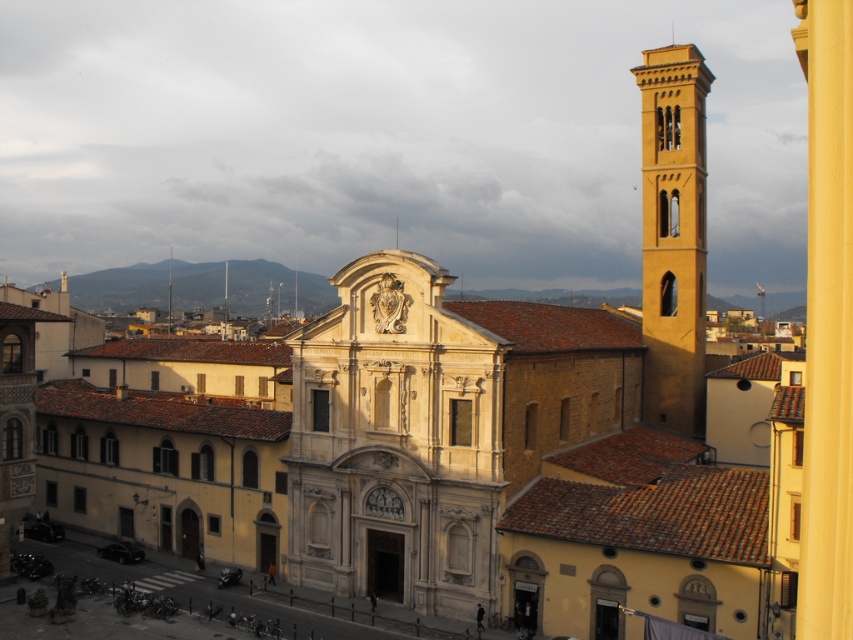
Question: Can you confirm if white stone church at center is positioned to the right of matte yellow bell tower at right?

Choices:
 (A) no
 (B) yes

Answer: (A)

Question: Which point appears farthest from the camera in this image?

Choices:
 (A) [492, 481]
 (B) [692, 244]

Answer: (B)

Question: Which object is farther from the camera taking this photo?

Choices:
 (A) matte yellow bell tower at right
 (B) white stone church at center

Answer: (A)

Question: Can you confirm if yellow smooth pillar at center is positioned to the left of matte yellow bell tower at right?

Choices:
 (A) no
 (B) yes

Answer: (A)

Question: Is white stone church at center thinner than yellow smooth pillar at center?

Choices:
 (A) no
 (B) yes

Answer: (B)

Question: Estimate the real-world distances between objects in this image. Which object is farther from the yellow smooth pillar at center?

Choices:
 (A) white stone church at center
 (B) matte yellow bell tower at right

Answer: (B)